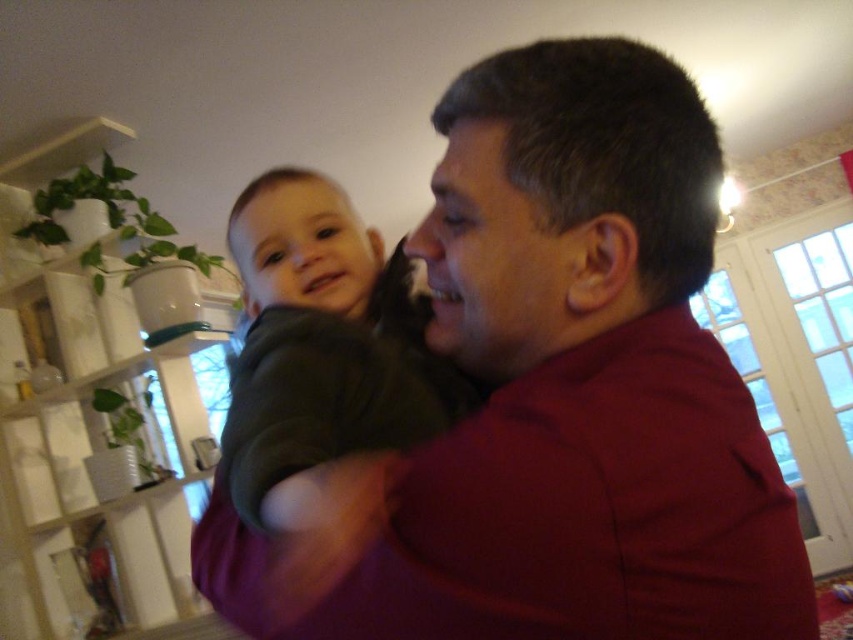
Question: Which point is closer to the camera?

Choices:
 (A) (340, 436)
 (B) (270, 602)

Answer: (B)

Question: Does matte red shirt at center appear over dark green sweater at center?

Choices:
 (A) no
 (B) yes

Answer: (A)

Question: In this image, where is matte red shirt at center located relative to dark green sweater at center?

Choices:
 (A) right
 (B) left

Answer: (A)

Question: Which object appears farthest from the camera in this image?

Choices:
 (A) dark green sweater at center
 (B) matte red shirt at center

Answer: (A)

Question: From the image, what is the correct spatial relationship of matte red shirt at center in relation to dark green sweater at center?

Choices:
 (A) below
 (B) above

Answer: (A)